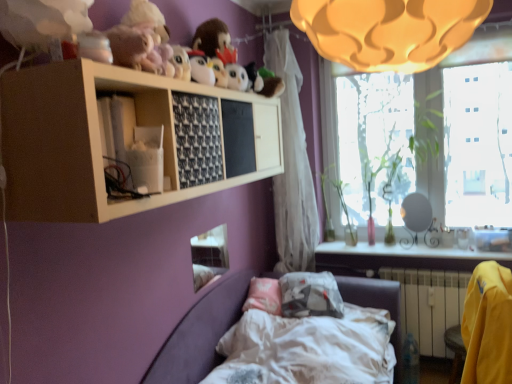
This screenshot has width=512, height=384. Find the location of `vacant region above white plastic radiator at lower right (from a real-world perspective)`. vacant region above white plastic radiator at lower right (from a real-world perspective) is located at coordinates (425, 265).